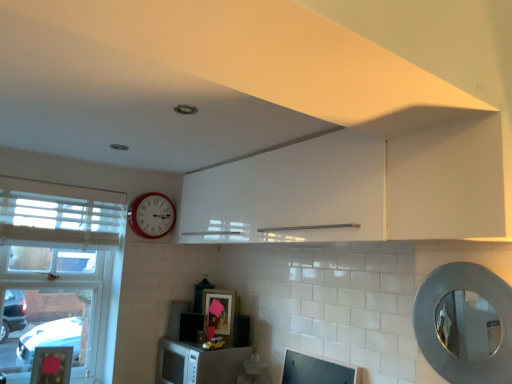
Question: From the image's perspective, is satin black microwave at lower center, which is counted as the second appliance, starting from the front, located above or below silver textured mirror at right?

Choices:
 (A) above
 (B) below

Answer: (B)

Question: Considering the positions of satin black microwave at lower center, positioned as the 1th appliance in left-to-right order, and silver textured mirror at right in the image, is satin black microwave at lower center, positioned as the 1th appliance in left-to-right order, taller or shorter than silver textured mirror at right?

Choices:
 (A) short
 (B) tall

Answer: (A)

Question: Estimate the real-world distances between objects in this image. Which object is closer to the white wooden window at left?

Choices:
 (A) satin black microwave at lower center, which ranks as the 2th appliance in right-to-left order
 (B) white matte microwave at lower center
 (C) silver textured mirror at right
 (D) matte black picture frame at center
 (E) black matte microwave at center, acting as the 2th appliance starting from the back

Answer: (A)

Question: Estimate the real-world distances between objects in this image. Which object is farther from the satin black microwave at lower center, which appears as the first appliance when viewed from the back?

Choices:
 (A) matte black monitor at lower center
 (B) white matte microwave at lower center
 (C) matte black picture frame at center
 (D) white glossy cabinet at upper center
 (E) silver textured mirror at right

Answer: (E)